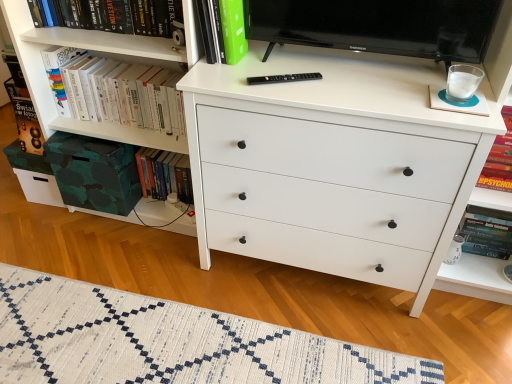
Measure the distance between black glossy television at upper center and camera.

black glossy television at upper center and camera are 1.19 meters apart.

What do you see at coordinates (378, 26) in the screenshot? The image size is (512, 384). I see `black glossy television at upper center` at bounding box center [378, 26].

Image resolution: width=512 pixels, height=384 pixels. What do you see at coordinates (486, 235) in the screenshot?
I see `hardcover book at lower right` at bounding box center [486, 235].

Locate an element on the screen. The height and width of the screenshot is (384, 512). hardcover book at right, positioned as the 1th book in right-to-left order is located at coordinates (499, 159).

Is hardcover book at lower left, the 3th book in the right-to-left sequence, wider or thinner than white woven rug at lower center?

In the image, hardcover book at lower left, the 3th book in the right-to-left sequence, appears to be more narrow than white woven rug at lower center.

Who is bigger, hardcover book at lower left, the 3th book in the right-to-left sequence, or white woven rug at lower center?

With larger size is white woven rug at lower center.

Is hardcover book at lower left, the 2th book when ordered from left to right, oriented towards white woven rug at lower center?

Yes, hardcover book at lower left, the 2th book when ordered from left to right, is oriented towards white woven rug at lower center.

From the white woven rug at lower center, count the 1st book to the left and point to it. Please provide its 2D coordinates.

[(164, 174)]

Based on the photo, could you tell me if black glossy television at upper center is facing white matte chest of drawers at center?

No, black glossy television at upper center is not turned towards white matte chest of drawers at center.

Is black glossy television at upper center touching white matte chest of drawers at center?

There is a gap between black glossy television at upper center and white matte chest of drawers at center.

From the image's perspective, which one is positioned higher, black glossy television at upper center or white matte chest of drawers at center?

From the image's view, black glossy television at upper center is above.

Which of these two, hardcover books at upper left or hardcover book at right, positioned as the 1th book in right-to-left order, stands taller?

With more height is hardcover book at right, positioned as the 1th book in right-to-left order.

Does hardcover books at upper left appear on the left side of hardcover book at right, positioned as the 1th book in right-to-left order?

Yes, hardcover books at upper left is to the left of hardcover book at right, positioned as the 1th book in right-to-left order.

Is hardcover books at upper left not inside hardcover book at right, positioned as the fourth book in left-to-right order?

That's correct, hardcover books at upper left is outside of hardcover book at right, positioned as the fourth book in left-to-right order.

Could you tell me if hardcover books at upper left is turned towards hardcover book at right, positioned as the fourth book in left-to-right order?

No, hardcover books at upper left is not oriented towards hardcover book at right, positioned as the fourth book in left-to-right order.

Which of these two, hardcover book at right, positioned as the 1th book in right-to-left order, or hardcover book at lower left, the 3th book in the right-to-left sequence, stands shorter?

Standing shorter between the two is hardcover book at lower left, the 3th book in the right-to-left sequence.

Which object is further away from the camera taking this photo, hardcover book at right, positioned as the 1th book in right-to-left order, or hardcover book at lower left, the 3th book in the right-to-left sequence?

hardcover book at lower left, the 3th book in the right-to-left sequence.

Which object is wider, hardcover book at right, positioned as the 1th book in right-to-left order, or hardcover book at lower left, the 3th book in the right-to-left sequence?

hardcover book at right, positioned as the 1th book in right-to-left order.

Is hardcover book at right, positioned as the fourth book in left-to-right order, facing away from hardcover book at lower left, the 3th book in the right-to-left sequence?

No, hardcover book at right, positioned as the fourth book in left-to-right order, is not facing away from hardcover book at lower left, the 3th book in the right-to-left sequence.

Is green matte book at upper center, the third book positioned from the left, located outside black glossy television at upper center?

green matte book at upper center, the third book positioned from the left, is positioned outside black glossy television at upper center.

Is green matte book at upper center, which ranks as the 2th book in right-to-left order, bigger than black glossy television at upper center?

No.

Between green matte book at upper center, the third book positioned from the left, and black glossy television at upper center, which one is positioned behind?

green matte book at upper center, the third book positioned from the left, is behind.

In order to click on television above the green matte book at upper center, the third book positioned from the left (from a real-world perspective) in this screenshot , I will do `click(378, 26)`.

From the image's perspective, is hardcover book at lower right located above white woven rug at lower center?

Yes, from the image's perspective, hardcover book at lower right is above white woven rug at lower center.

Is hardcover book at lower right next to white woven rug at lower center?

No, hardcover book at lower right is not in contact with white woven rug at lower center.

Is hardcover book at lower right oriented away from white woven rug at lower center?

hardcover book at lower right does not have its back to white woven rug at lower center.

Can you confirm if hardcover book at lower right is positioned to the left of white woven rug at lower center?

No.

Is there a large distance between hardcover books at upper left and white paper book at upper left, the fourth book positioned from the right?

hardcover books at upper left is near white paper book at upper left, the fourth book positioned from the right, not far away.

Between point (91, 34) and point (61, 71), which one is positioned behind?

The point (61, 71) is farther from the camera.

I want to click on shelf above the white paper book at upper left, which is the first book in left-to-right order (from the image's perspective), so click(103, 36).

Considering the relative positions of hardcover books at upper left and white paper book at upper left, the fourth book positioned from the right, in the image provided, is hardcover books at upper left to the left of white paper book at upper left, the fourth book positioned from the right, from the viewer's perspective?

Indeed, hardcover books at upper left is positioned on the left side of white paper book at upper left, the fourth book positioned from the right.

The width and height of the screenshot is (512, 384). Identify the location of blanket to the right of hardcover book at lower left, the 2th book when ordered from left to right. pos(169,342).

Where is `chest of drawers below the black glossy television at upper center (from a real-world perspective)`? chest of drawers below the black glossy television at upper center (from a real-world perspective) is located at coordinates (333, 164).

Considering their positions, is hardcover book at lower left, the 3th book in the right-to-left sequence, positioned further to hardcover books at upper left than hardcover book at lower right?

Based on the image, hardcover book at lower right appears to be further to hardcover books at upper left.

Looking at the image, which one is located closer to black glossy television at upper center, hardcover book at lower right or hardcover book at right, positioned as the fourth book in left-to-right order?

Among the two, hardcover book at right, positioned as the fourth book in left-to-right order, is located nearer to black glossy television at upper center.

Estimate the real-world distances between objects in this image. Which object is closer to white matte chest of drawers at center, hardcover book at lower left, the 2th book when ordered from left to right, or hardcover book at lower right?

Among the two, hardcover book at lower right is located nearer to white matte chest of drawers at center.

Considering their positions, is hardcover books at upper left positioned further to green matte book at upper center, which ranks as the 2th book in right-to-left order, than white woven rug at lower center?

white woven rug at lower center lies further to green matte book at upper center, which ranks as the 2th book in right-to-left order, than the other object.

When comparing their distances from hardcover book at right, positioned as the 1th book in right-to-left order, does hardcover book at lower right or white woven rug at lower center seem closer?

hardcover book at lower right.

From the image, which object appears to be farther from white paper book at upper left, which is the first book in left-to-right order, green matte book at upper center, which ranks as the 2th book in right-to-left order, or hardcover books at upper left?

green matte book at upper center, which ranks as the 2th book in right-to-left order, lies further to white paper book at upper left, which is the first book in left-to-right order, than the other object.

Which object lies further to the anchor point hardcover book at lower right, hardcover book at right, positioned as the 1th book in right-to-left order, or green matte book at upper center, the third book positioned from the left?

green matte book at upper center, the third book positioned from the left.

Which object lies nearer to the anchor point white matte chest of drawers at center, hardcover book at lower left, the 3th book in the right-to-left sequence, or white paper book at upper left, the fourth book positioned from the right?

Among the two, white paper book at upper left, the fourth book positioned from the right, is located nearer to white matte chest of drawers at center.

The image size is (512, 384). What are the coordinates of `the chest of drawers located between hardcover books at upper left and black glossy television at upper center in the left-right direction` in the screenshot? It's located at (333, 164).

You are a GUI agent. You are given a task and a screenshot of the screen. Output one action in this format:
    pyautogui.click(x=<x>, y=<y>)
    Task: Click on the television situated between white matte chest of drawers at center and hardcover book at lower right from left to right
    
    Given the screenshot: What is the action you would take?
    pyautogui.click(x=378, y=26)

Where is `the chest of drawers located between white paper book at upper left, the fourth book positioned from the right, and black glossy television at upper center in the left-right direction`? This screenshot has width=512, height=384. the chest of drawers located between white paper book at upper left, the fourth book positioned from the right, and black glossy television at upper center in the left-right direction is located at coordinates (333, 164).

This screenshot has width=512, height=384. Find the location of `television between green matte book at upper center, the third book positioned from the left, and white matte chest of drawers at center vertically`. television between green matte book at upper center, the third book positioned from the left, and white matte chest of drawers at center vertically is located at coordinates (378, 26).